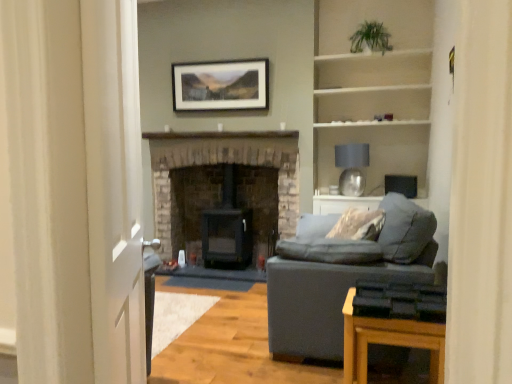
Question: From the image's perspective, is matte gray fabric couch at right on matte black picture frame at upper center?

Choices:
 (A) no
 (B) yes

Answer: (A)

Question: Is matte gray fabric couch at right facing towards matte black picture frame at upper center?

Choices:
 (A) yes
 (B) no

Answer: (B)

Question: From the image's perspective, would you say matte gray fabric couch at right is shown under matte black picture frame at upper center?

Choices:
 (A) yes
 (B) no

Answer: (A)

Question: Does matte gray fabric couch at right come behind matte black picture frame at upper center?

Choices:
 (A) yes
 (B) no

Answer: (B)

Question: Is matte gray fabric couch at right positioned beyond the bounds of matte black picture frame at upper center?

Choices:
 (A) yes
 (B) no

Answer: (A)

Question: Is white glossy door at left bigger or smaller than white wooden shelves at upper right?

Choices:
 (A) small
 (B) big

Answer: (A)

Question: Considering the positions of white glossy door at left and white wooden shelves at upper right in the image, is white glossy door at left taller or shorter than white wooden shelves at upper right?

Choices:
 (A) tall
 (B) short

Answer: (A)

Question: Is white glossy door at left inside the boundaries of white wooden shelves at upper right, or outside?

Choices:
 (A) outside
 (B) inside

Answer: (A)

Question: From the image's perspective, is white glossy door at left above or below white wooden shelves at upper right?

Choices:
 (A) above
 (B) below

Answer: (B)

Question: Would you say brick fireplace at center, positioned as the second fireplace in right-to-left order, is inside or outside wooden table at lower right?

Choices:
 (A) outside
 (B) inside

Answer: (A)

Question: In terms of height, does brick fireplace at center, arranged as the 1th fireplace when viewed from the left, look taller or shorter compared to wooden table at lower right?

Choices:
 (A) tall
 (B) short

Answer: (A)

Question: Considering their positions, is brick fireplace at center, arranged as the 1th fireplace when viewed from the left, located in front of or behind wooden table at lower right?

Choices:
 (A) behind
 (B) front

Answer: (A)

Question: Is point (170, 148) positioned closer to the camera than point (364, 364)?

Choices:
 (A) closer
 (B) farther

Answer: (B)

Question: Looking at the image, does green leafy plant at upper right seem bigger or smaller compared to white wooden shelves at upper right?

Choices:
 (A) small
 (B) big

Answer: (A)

Question: Is green leafy plant at upper right inside the boundaries of white wooden shelves at upper right, or outside?

Choices:
 (A) inside
 (B) outside

Answer: (B)